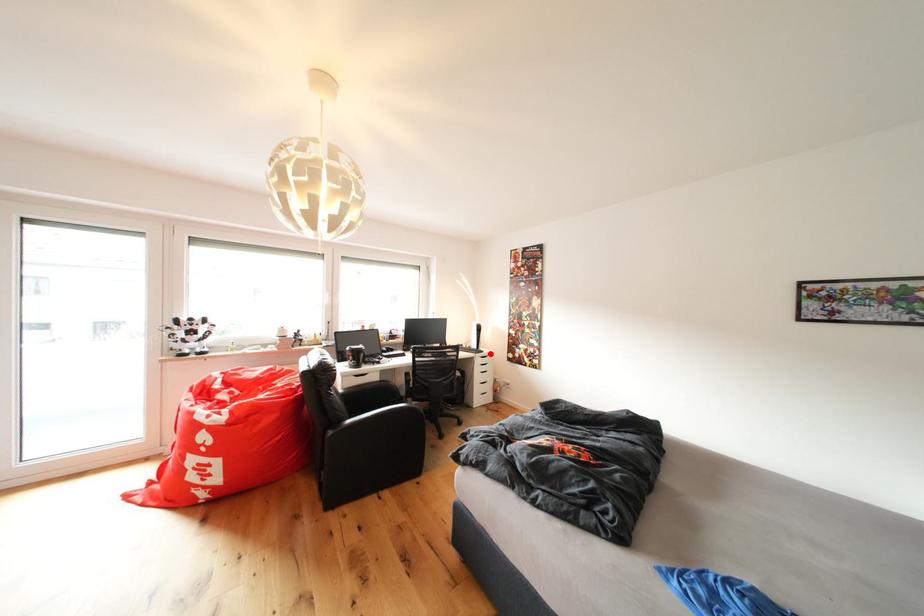
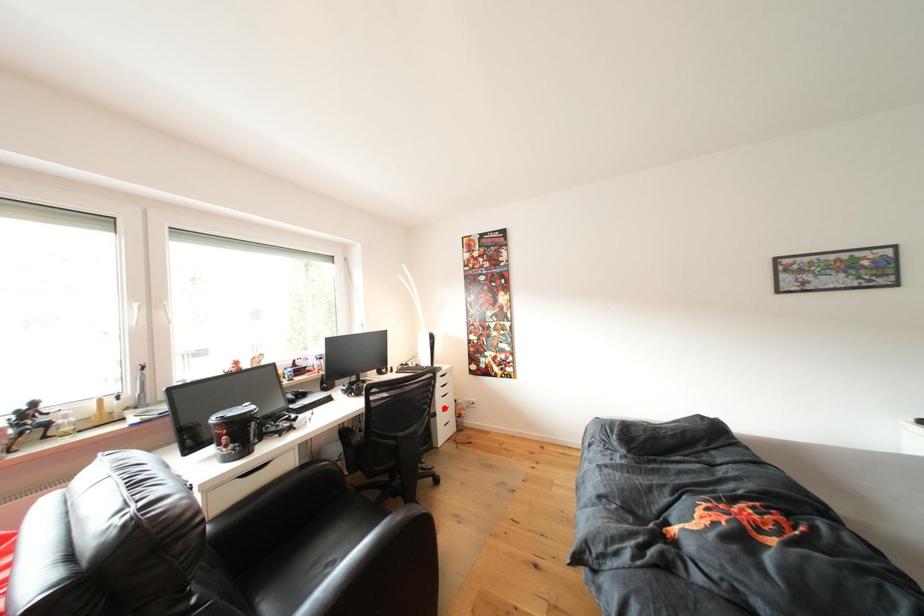
I am providing you with two images of the same scene from different viewpoints. A red point is marked on the first image and another point is marked on the second image. Do the highlighted points in image1 and image2 indicate the same real-world spot?

No